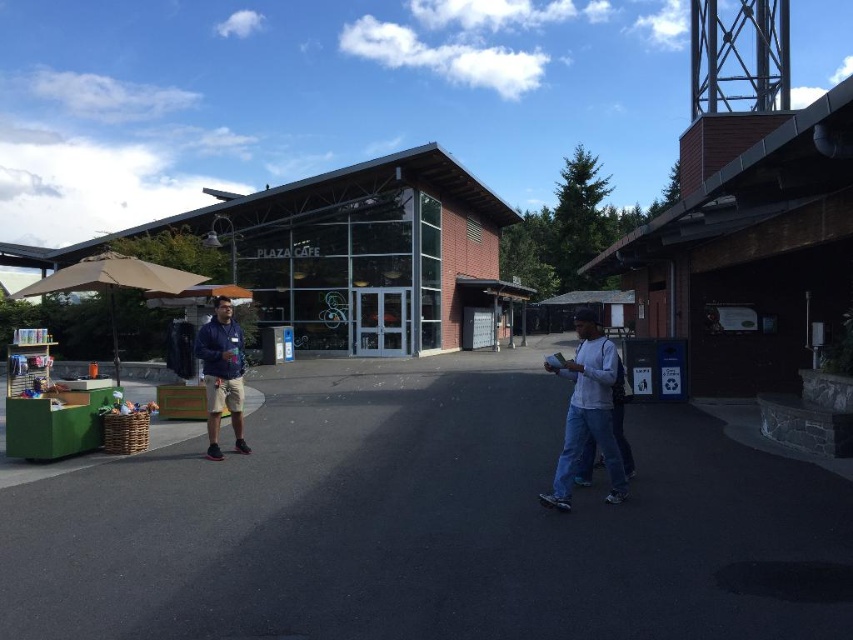
Based on the photo, does brick building at center have a smaller size compared to tan fabric umbrella at left?

No, brick building at center is not smaller than tan fabric umbrella at left.

Find the location of `brick building at center`. brick building at center is located at coordinates (344, 246).

Does point (303, 314) come behind point (114, 323)?

Yes, it is behind point (114, 323).

I want to click on brick building at center, so click(344, 246).

Is brick building at center shorter than white matte shirt at center?

No.

Which is behind, point (364, 257) or point (592, 381)?

Positioned behind is point (364, 257).

This screenshot has width=853, height=640. What do you see at coordinates (344, 246) in the screenshot?
I see `brick building at center` at bounding box center [344, 246].

Locate an element on the screen. The image size is (853, 640). brick building at center is located at coordinates (344, 246).

Which of these two, navy blue jacket at center or tan fabric umbrella at left, stands shorter?

navy blue jacket at center

Who is higher up, navy blue jacket at center or tan fabric umbrella at left?

tan fabric umbrella at left

Locate an element on the screen. Image resolution: width=853 pixels, height=640 pixels. navy blue jacket at center is located at coordinates (222, 374).